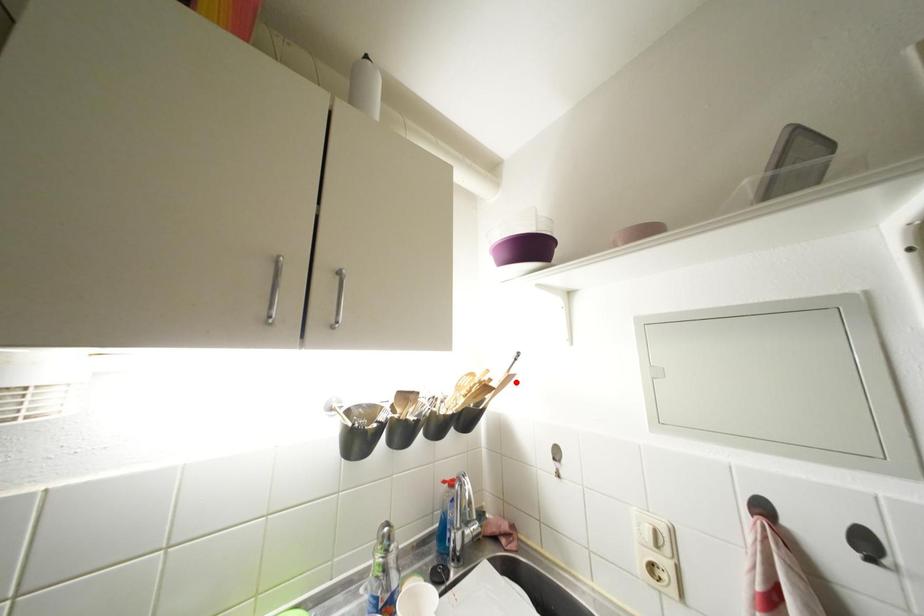
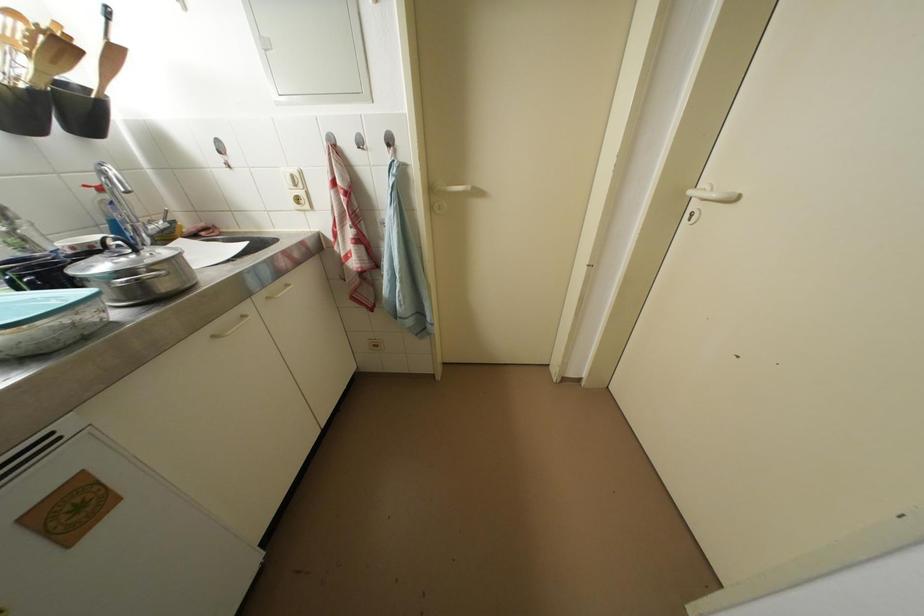
Where in the second image is the point corresponding to the highlighted location from the first image?

(120, 55)